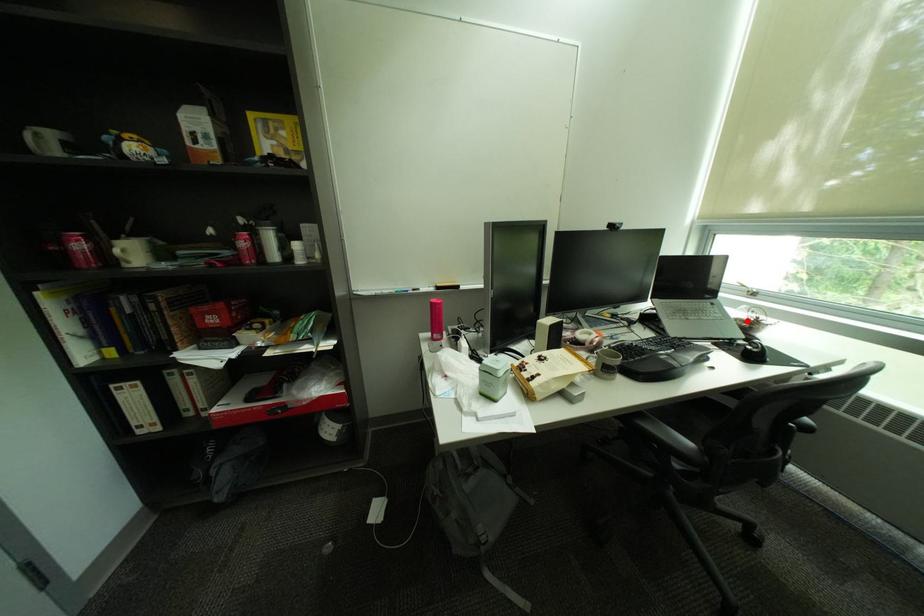
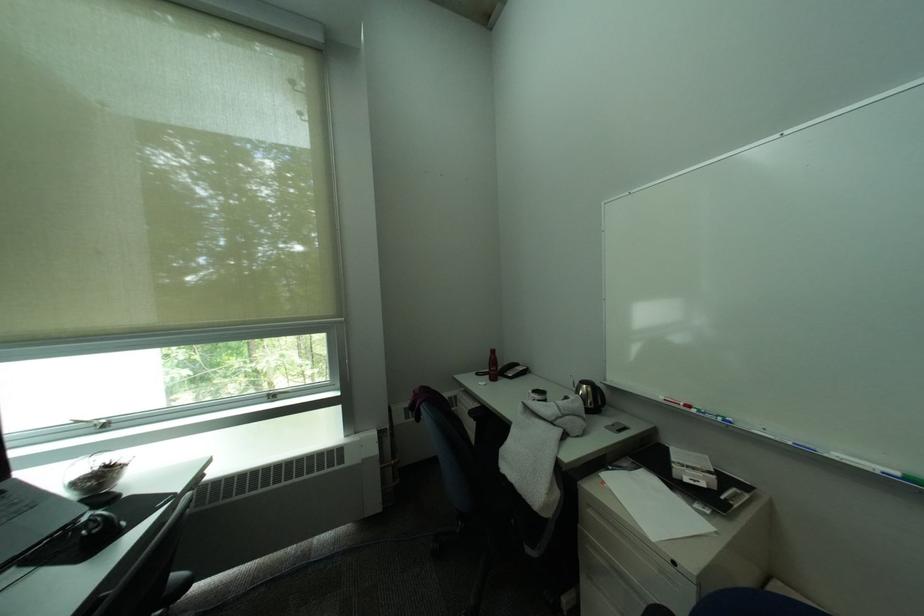
Find the pixel in the second image that matches the highlighted location in the first image.

(84, 485)